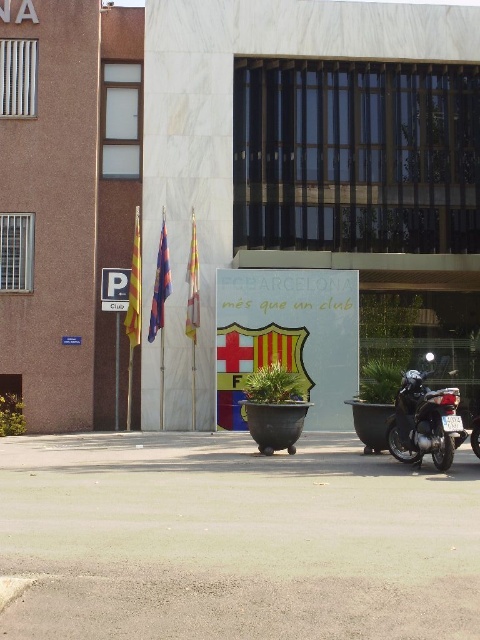
You are a city planner assessing the flags in front of the FC Barcelona building. The yellow fabric flag at left and the polyester flag at left are both displayed on the same flagpole. Which flag has a wider span when fully unfurled?

The polyester flag at left has a wider span when fully unfurled since its width is greater than the yellow fabric flag at left.

You are standing in front of the FC Barcelona building and notice two points marked on the facade. Which point, point 1 at coordinates (133,298) or point 2 at coordinates (166,298), is closer to you?

Point 1 at coordinates (133,298) is closer to the viewer than point 2 at coordinates (166,298).

You are standing at the entrance of the FC Barcelona building and want to find the two specific points marked on the building facade. The first point is at coordinates point(x=405, y=428) and the second point is at point(x=195, y=227). Which of these two points is closer to you?

Point(x=405, y=428) is in front of point(x=195, y=227), so the first point is closer to you.